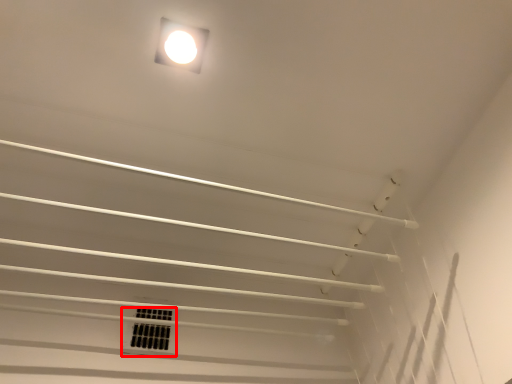
Question: Considering the relative positions of window (annotated by the red box) and lamp in the image provided, where is window (annotated by the red box) located with respect to the staircase?

Choices:
 (A) right
 (B) left

Answer: (B)